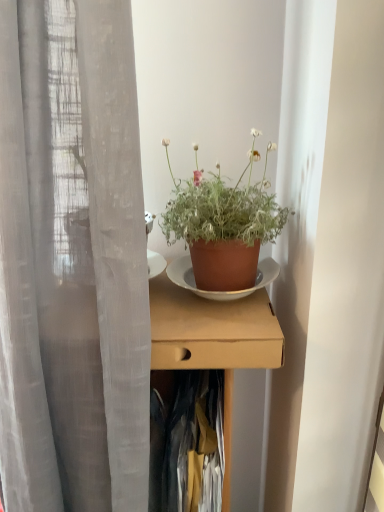
Question: Considering the relative positions of brown cardboard box at center and terracotta pot at center in the image provided, is brown cardboard box at center behind terracotta pot at center?

Choices:
 (A) no
 (B) yes

Answer: (A)

Question: Is brown cardboard box at center looking in the opposite direction of terracotta pot at center?

Choices:
 (A) yes
 (B) no

Answer: (B)

Question: Can you confirm if brown cardboard box at center is smaller than terracotta pot at center?

Choices:
 (A) yes
 (B) no

Answer: (B)

Question: Considering the relative sizes of brown cardboard box at center and terracotta pot at center in the image provided, is brown cardboard box at center thinner than terracotta pot at center?

Choices:
 (A) no
 (B) yes

Answer: (A)

Question: From a real-world perspective, does brown cardboard box at center sit lower than terracotta pot at center?

Choices:
 (A) no
 (B) yes

Answer: (B)

Question: Is terracotta pot at center taller or shorter than brown cardboard box at center?

Choices:
 (A) short
 (B) tall

Answer: (A)

Question: In the image, is terracotta pot at center positioned in front of or behind brown cardboard box at center?

Choices:
 (A) behind
 (B) front

Answer: (A)

Question: From a real-world perspective, is terracotta pot at center positioned above or below brown cardboard box at center?

Choices:
 (A) below
 (B) above

Answer: (B)

Question: Considering the positions of terracotta pot at center and brown cardboard box at center in the image, is terracotta pot at center bigger or smaller than brown cardboard box at center?

Choices:
 (A) big
 (B) small

Answer: (B)

Question: Does point (196, 505) appear closer or farther from the camera than point (155, 281)?

Choices:
 (A) farther
 (B) closer

Answer: (B)

Question: Is dark blue fabric at center in front of or behind brown cardboard box at center in the image?

Choices:
 (A) front
 (B) behind

Answer: (B)

Question: In terms of width, does dark blue fabric at center look wider or thinner when compared to brown cardboard box at center?

Choices:
 (A) wide
 (B) thin

Answer: (B)

Question: From a real-world perspective, is dark blue fabric at center physically located above or below brown cardboard box at center?

Choices:
 (A) below
 (B) above

Answer: (A)

Question: Is point (195, 298) positioned closer to the camera than point (238, 194)?

Choices:
 (A) farther
 (B) closer

Answer: (A)

Question: From the image's perspective, is brown cardboard box at center located above or below terracotta pot at center?

Choices:
 (A) below
 (B) above

Answer: (A)